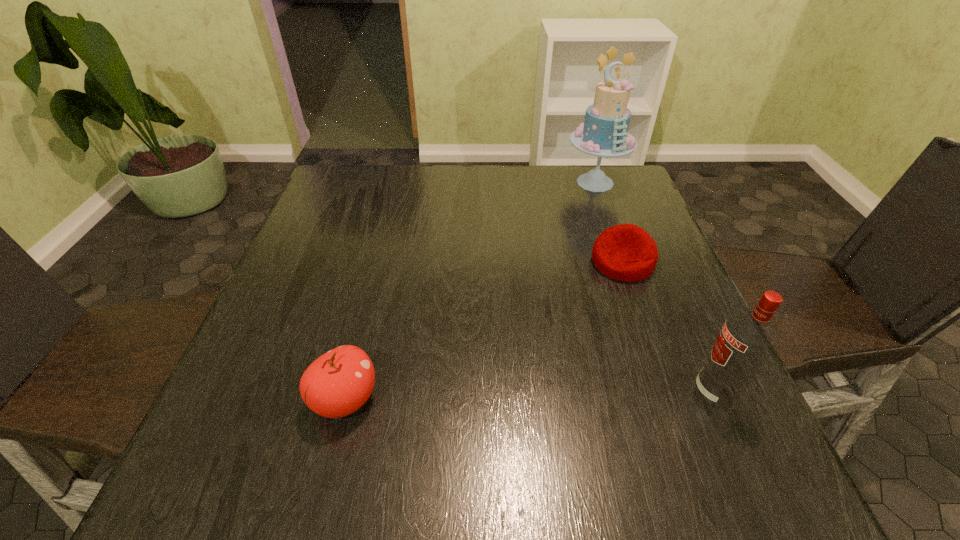
Image resolution: width=960 pixels, height=540 pixels. Identify the location of object that is positioned at the left edge. (339, 382).

At what (x,y) coordinates should I click in order to perform the action: click on vodka situated at the right edge. Please return your answer as a coordinate pair (x, y). The width and height of the screenshot is (960, 540). Looking at the image, I should click on (747, 339).

Locate an element on the screen. beanbag that is at the right edge is located at coordinates (625, 252).

Locate an element on the screen. This screenshot has height=540, width=960. cake at the right edge is located at coordinates (604, 133).

Where is `object positioned at the near left corner`? object positioned at the near left corner is located at coordinates (339, 382).

At what (x,y) coordinates should I click in order to perform the action: click on object that is at the far right corner. Please return your answer as a coordinate pair (x, y). The image size is (960, 540). Looking at the image, I should click on (604, 133).

This screenshot has height=540, width=960. In order to click on object present at the near right corner in this screenshot , I will do `click(747, 339)`.

Locate an element on the screen. free spot at the far edge of the desktop is located at coordinates (553, 170).

In the image, there is a desktop. Find the location of `blank space at the near edge`. blank space at the near edge is located at coordinates (414, 420).

The width and height of the screenshot is (960, 540). I want to click on vacant area at the left edge, so click(x=280, y=320).